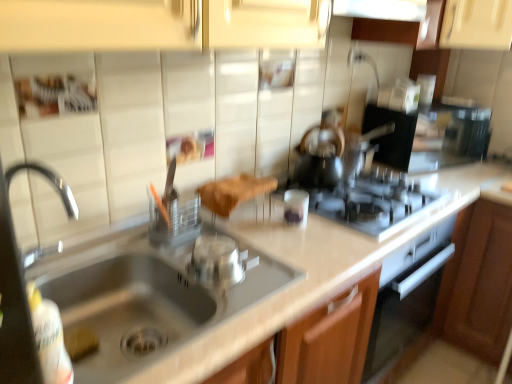
Question: Does silver metallic pot at center, arranged as the first appliance when viewed from the left, appear on the left side of black plastic coffee machine at upper right?

Choices:
 (A) no
 (B) yes

Answer: (B)

Question: Is black plastic coffee machine at upper right located within silver metallic pot at center, placed as the 1th appliance when sorted from front to back?

Choices:
 (A) yes
 (B) no

Answer: (B)

Question: Are silver metallic pot at center, arranged as the first appliance when viewed from the left, and black plastic coffee machine at upper right far apart?

Choices:
 (A) yes
 (B) no

Answer: (A)

Question: Is black plastic coffee machine at upper right at the back of silver metallic pot at center, which is the 2th appliance from back to front?

Choices:
 (A) no
 (B) yes

Answer: (A)

Question: Is silver metallic pot at center, which is the 2th appliance from back to front, aimed at black plastic coffee machine at upper right?

Choices:
 (A) yes
 (B) no

Answer: (B)

Question: Considering the relative sizes of silver metallic pot at center, placed as the 1th appliance when sorted from front to back, and black plastic coffee machine at upper right in the image provided, is silver metallic pot at center, placed as the 1th appliance when sorted from front to back, shorter than black plastic coffee machine at upper right?

Choices:
 (A) no
 (B) yes

Answer: (B)

Question: From a real-world perspective, does beige laminate counter top at center sit lower than brown wood cabinet at lower right?

Choices:
 (A) no
 (B) yes

Answer: (A)

Question: Is beige laminate counter top at center placed right next to brown wood cabinet at lower right?

Choices:
 (A) yes
 (B) no

Answer: (B)

Question: From a real-world perspective, is beige laminate counter top at center physically above brown wood cabinet at lower right?

Choices:
 (A) yes
 (B) no

Answer: (A)

Question: Are beige laminate counter top at center and brown wood cabinet at lower right far apart?

Choices:
 (A) no
 (B) yes

Answer: (A)

Question: From the image's perspective, would you say beige laminate counter top at center is shown under brown wood cabinet at lower right?

Choices:
 (A) yes
 (B) no

Answer: (A)

Question: Is the depth of beige laminate counter top at center greater than that of brown wood cabinet at lower right?

Choices:
 (A) yes
 (B) no

Answer: (B)

Question: Considering the relative positions of brown wood cabinet at lower right and translucent glass tea pot at center in the image provided, is brown wood cabinet at lower right to the right of translucent glass tea pot at center from the viewer's perspective?

Choices:
 (A) yes
 (B) no

Answer: (A)